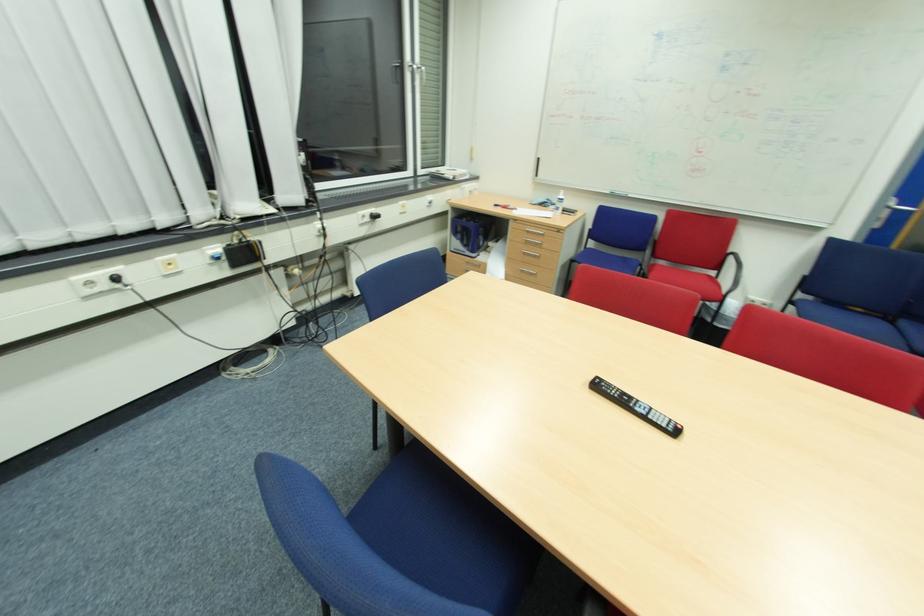
Where would you pull the door handle? Please return your answer as a coordinate pair (x, y).

(898, 207)